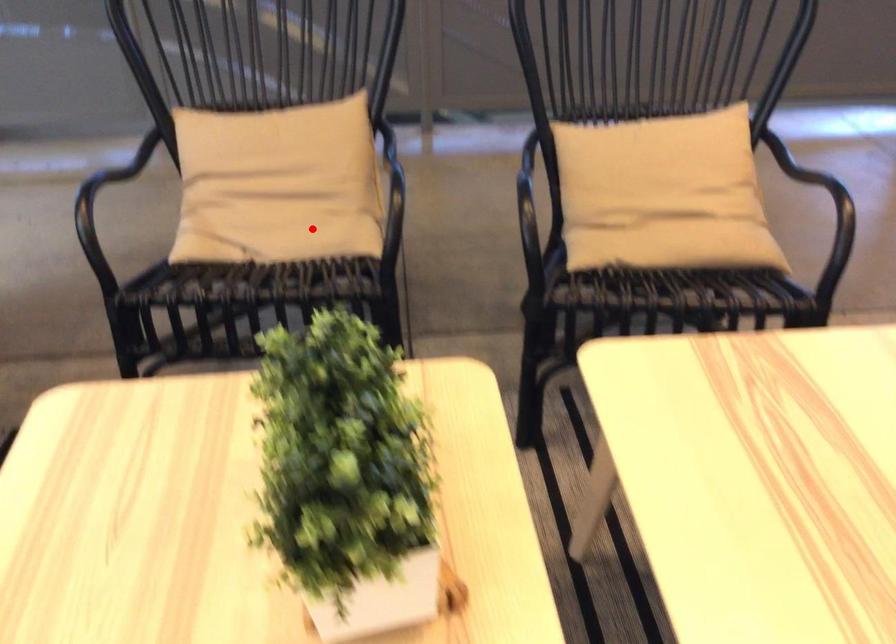
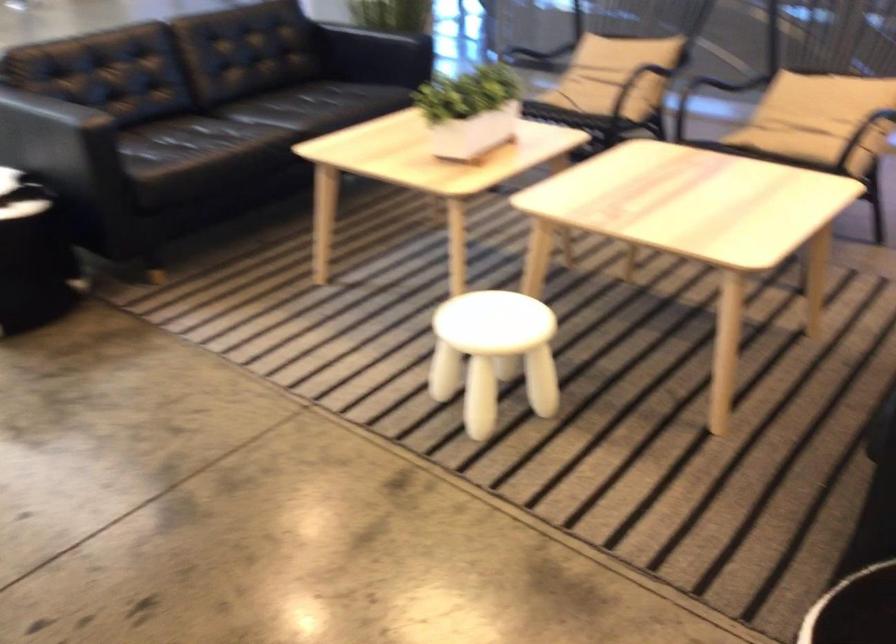
Question: A red point is marked in image1. In image2, is the corresponding 3D point closer to the camera or farther? Reply with the corresponding letter.

Choices:
 (A) The corresponding 3D point is closer.
 (B) The corresponding 3D point is farther.

Answer: (B)